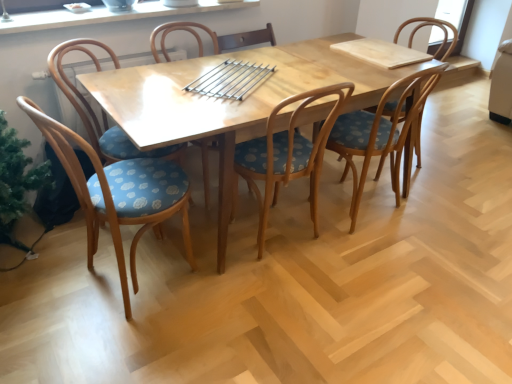
Question: Which direction should I rotate to look at wooden chair with blue polka dot seat at center, the 4th chair from the right, — up or down?

Choices:
 (A) up
 (B) down

Answer: (A)

Question: Is blue polka dot fabric chair at left, which is the first chair from left to right, completely or partially outside of wooden chair with blue polka dot seat at center, which ranks as the 3th chair in right-to-left order?

Choices:
 (A) no
 (B) yes

Answer: (B)

Question: Is blue polka dot fabric chair at left, the sixth chair when ordered from right to left, thinner than wooden chair with blue polka dot seat at center, acting as the 4th chair starting from the left?

Choices:
 (A) no
 (B) yes

Answer: (A)

Question: From a real-world perspective, is blue polka dot fabric chair at left, which is the first chair from left to right, under wooden chair with blue polka dot seat at center, which ranks as the 3th chair in right-to-left order?

Choices:
 (A) no
 (B) yes

Answer: (B)

Question: Is blue polka dot fabric chair at left, the sixth chair when ordered from right to left, far away from wooden chair with blue polka dot seat at center, acting as the 4th chair starting from the left?

Choices:
 (A) yes
 (B) no

Answer: (B)

Question: Is blue polka dot fabric chair at left, the sixth chair when ordered from right to left, directly adjacent to wooden chair with blue polka dot seat at center, which ranks as the 3th chair in right-to-left order?

Choices:
 (A) yes
 (B) no

Answer: (B)

Question: From a real-world perspective, is blue polka dot fabric chair at left, which is the first chair from left to right, on top of wooden chair with blue polka dot seat at center, acting as the 4th chair starting from the left?

Choices:
 (A) no
 (B) yes

Answer: (A)

Question: Could you tell me if blue polka dot wood chair at left, which is the 2th chair from left to right, is turned towards wooden chair with blue polka dot seat at center, which ranks as the 3th chair in right-to-left order?

Choices:
 (A) yes
 (B) no

Answer: (A)

Question: Is blue polka dot wood chair at left, which is the 2th chair from left to right, turned away from wooden chair with blue polka dot seat at center, which ranks as the 3th chair in right-to-left order?

Choices:
 (A) yes
 (B) no

Answer: (B)

Question: Is blue polka dot wood chair at left, which appears as the fifth chair when viewed from the right, bigger than wooden chair with blue polka dot seat at center, acting as the 4th chair starting from the left?

Choices:
 (A) yes
 (B) no

Answer: (B)

Question: Considering the relative positions of blue polka dot wood chair at left, which appears as the fifth chair when viewed from the right, and wooden chair with blue polka dot seat at center, acting as the 4th chair starting from the left, in the image provided, is blue polka dot wood chair at left, which appears as the fifth chair when viewed from the right, behind wooden chair with blue polka dot seat at center, acting as the 4th chair starting from the left,?

Choices:
 (A) yes
 (B) no

Answer: (B)

Question: Is blue polka dot wood chair at left, which appears as the fifth chair when viewed from the right, closer to camera compared to wooden chair with blue polka dot seat at center, acting as the 4th chair starting from the left?

Choices:
 (A) no
 (B) yes

Answer: (B)

Question: Is blue polka dot wood chair at left, which is the 2th chair from left to right, located outside wooden chair with blue polka dot seat at center, which ranks as the 3th chair in right-to-left order?

Choices:
 (A) no
 (B) yes

Answer: (B)

Question: From a real-world perspective, is wooden chair with blue polka dot seat cushion at center, which is counted as the 5th chair, starting from the left, over wooden chair with blue polka dot seat at center, which is counted as the third chair, starting from the left?

Choices:
 (A) no
 (B) yes

Answer: (A)